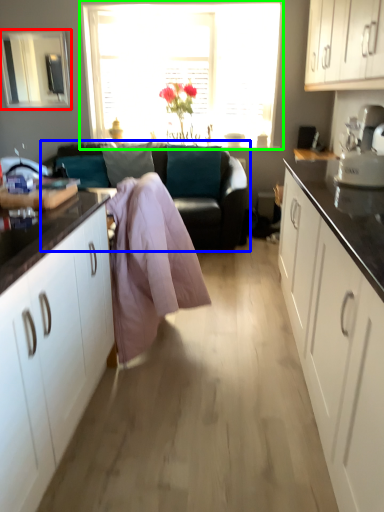
Question: Considering the real-world distances, which object is closest to window screen (highlighted by a red box)? studio couch (highlighted by a blue box) or window (highlighted by a green box).

Choices:
 (A) studio couch
 (B) window

Answer: (B)